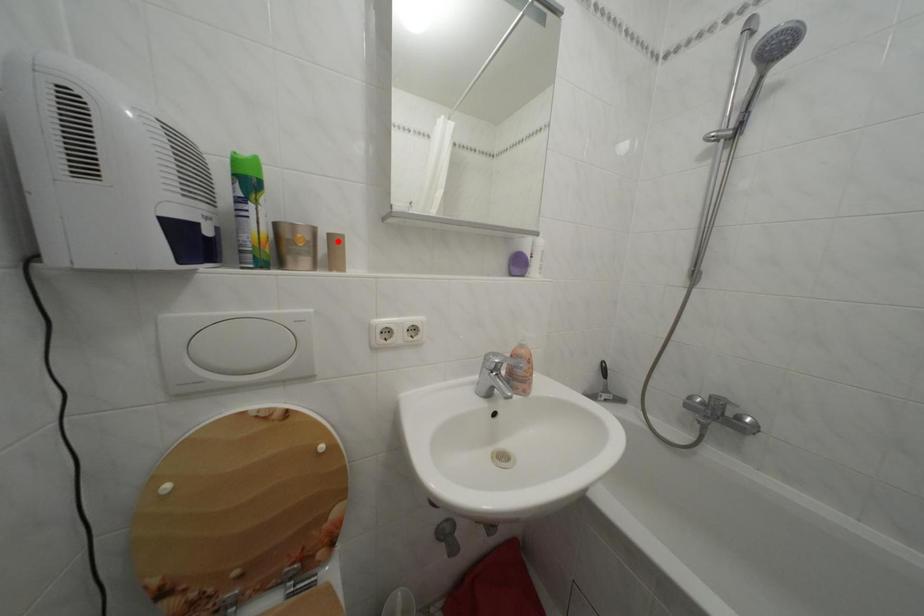
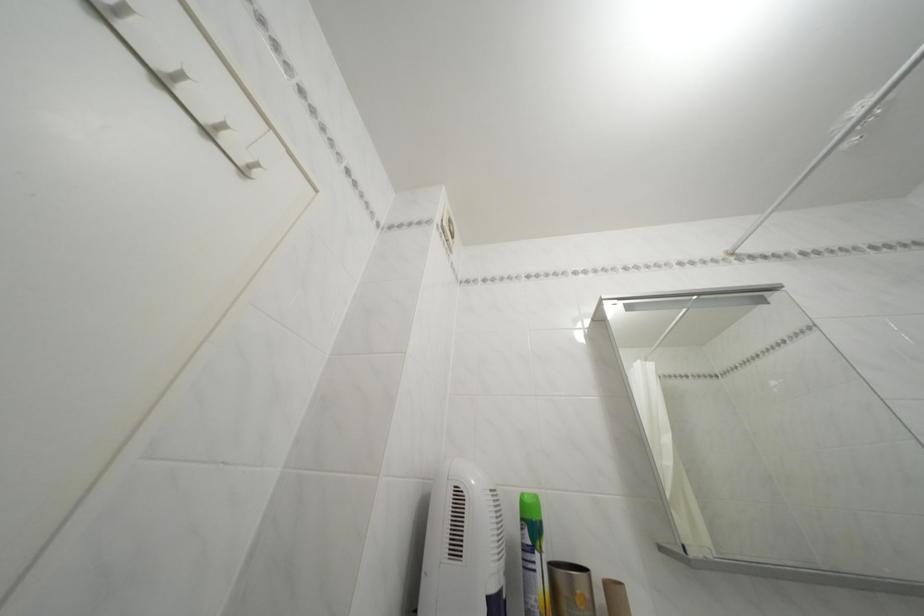
Find the pixel in the second image that matches the highlighted location in the first image.

(614, 591)